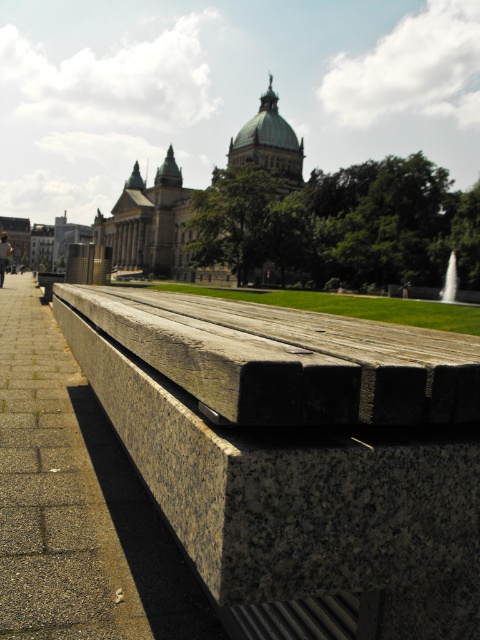
Does granite bench at lower center have a greater height compared to white marble fountain at center?

Incorrect, granite bench at lower center's height is not larger of white marble fountain at center's.

Who is taller, granite bench at lower center or white marble fountain at center?

white marble fountain at center is taller.

You are a GUI agent. You are given a task and a screenshot of the screen. Output one action in this format:
    pyautogui.click(x=<x>, y=<y>)
    Task: Click on the granite bench at lower center
    
    Given the screenshot: What is the action you would take?
    pyautogui.click(x=298, y=449)

Who is shorter, granite bench at lower center or yellow helmet at upper center?

With less height is granite bench at lower center.

What do you see at coordinates (298, 449) in the screenshot? The image size is (480, 640). I see `granite bench at lower center` at bounding box center [298, 449].

Locate an element on the screen. granite bench at lower center is located at coordinates (298, 449).

Identify the location of granite bench at lower center. [x=298, y=449].

Which is more to the right, white marble fountain at center or yellow helmet at upper center?

white marble fountain at center

Does white marble fountain at center have a greater width compared to yellow helmet at upper center?

In fact, white marble fountain at center might be narrower than yellow helmet at upper center.

Between point (452, 280) and point (2, 268), which one is positioned behind?

The point (452, 280) is more distant.

At what (x,y) coordinates should I click in order to perform the action: click on white marble fountain at center. Please return your answer as a coordinate pair (x, y). Looking at the image, I should click on (450, 280).